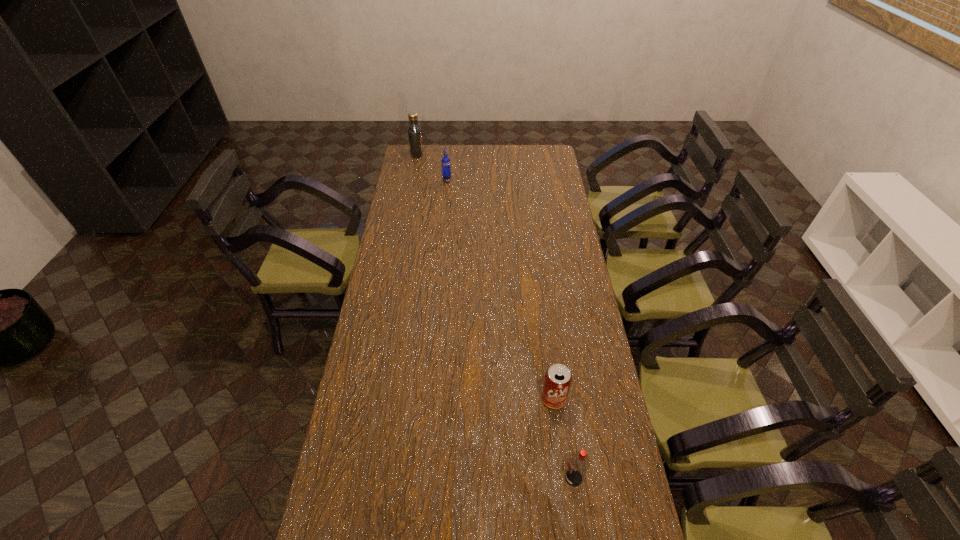
This screenshot has width=960, height=540. In order to click on vacant region at the right edge of the desktop in this screenshot , I will do `click(578, 360)`.

In the image, there is a desktop. Identify the location of vacant space at the far right corner. (527, 163).

Locate an element on the screen. This screenshot has height=540, width=960. free point between the third object from right to left and the rightmost vodka is located at coordinates (511, 329).

You are a GUI agent. You are given a task and a screenshot of the screen. Output one action in this format:
    pyautogui.click(x=<x>, y=<y>)
    Task: Click on the free space between the third farthest object and the second farthest object
    The height and width of the screenshot is (540, 960).
    Given the screenshot: What is the action you would take?
    pyautogui.click(x=500, y=289)

Locate an element on the screen. This screenshot has width=960, height=540. blank region between the farthest object and the third farthest object is located at coordinates (486, 276).

This screenshot has width=960, height=540. I want to click on vacant space that is in between the nearest object and the second nearest vodka, so click(511, 329).

Find the location of a particular element. Image resolution: width=960 pixels, height=540 pixels. empty space that is in between the rightmost vodka and the second nearest vodka is located at coordinates (511, 329).

At what (x,y) coordinates should I click in order to perform the action: click on vacant area that lies between the nearest object and the second nearest vodka. Please return your answer as a coordinate pair (x, y). The image size is (960, 540). Looking at the image, I should click on (511, 329).

Where is `free spot between the third farthest object and the tallest object`? The image size is (960, 540). free spot between the third farthest object and the tallest object is located at coordinates (486, 276).

This screenshot has height=540, width=960. I want to click on vacant area that lies between the second object from left to right and the farthest object, so click(x=432, y=167).